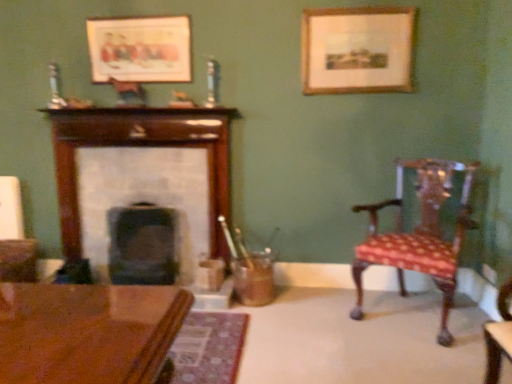
The image size is (512, 384). Identify the location of empty space that is ontop of wooden picture frame at upper right, which ranks as the 1th picture frame in right-to-left order (from a real-world perspective). (353, 8).